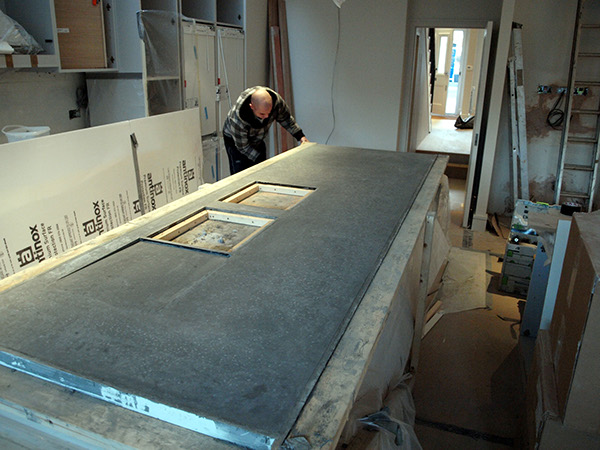
At what (x,y) coordinates should I click in order to perform the action: click on cubbies covered with wrap. Please return your answer as a coordinate pair (x, y). This screenshot has width=600, height=450. Looking at the image, I should click on (172, 47), (162, 86).